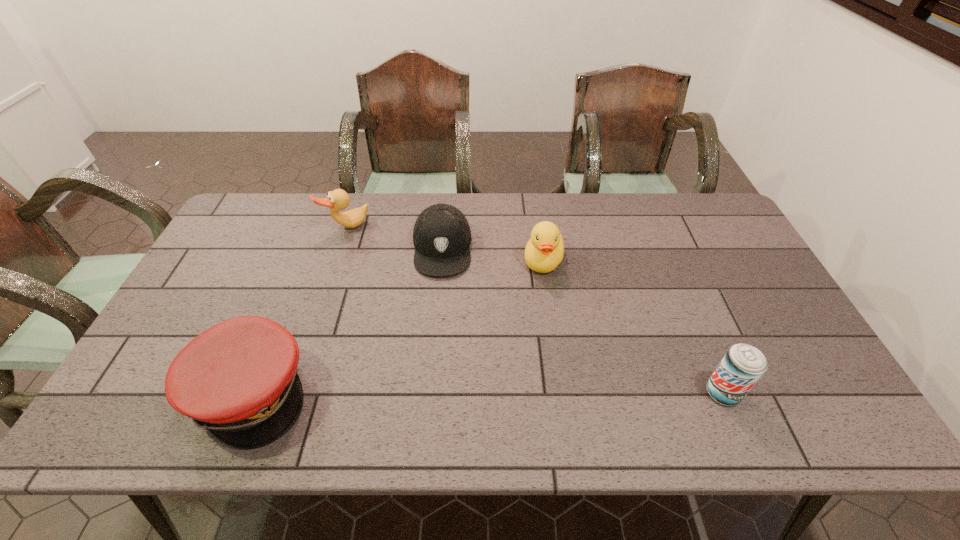
This screenshot has width=960, height=540. I want to click on blank space located 0.140m at the beak of the nearer duck, so click(x=528, y=314).

This screenshot has width=960, height=540. What are the coordinates of `free location located 0.110m at the beak of the nearer duck` in the screenshot? It's located at click(530, 306).

Find the location of `vacant region located 0.060m on the front-facing side of the third object from right to left`. vacant region located 0.060m on the front-facing side of the third object from right to left is located at coordinates pos(439,295).

You are a GUI agent. You are given a task and a screenshot of the screen. Output one action in this format:
    pyautogui.click(x=<x>, y=<y>)
    Task: Click on the vacant space located on the front-facing side of the third object from right to left
    
    Given the screenshot: What is the action you would take?
    click(439, 306)

Identify the location of vacant space positioned on the front-facing side of the third object from right to left. (439, 308).

In order to click on vacant space located on the beak of the left duck in this screenshot , I will do `click(386, 289)`.

Where is `free space located 0.280m on the beak of the left duck`? free space located 0.280m on the beak of the left duck is located at coordinates (387, 292).

Image resolution: width=960 pixels, height=540 pixels. Identify the location of vacant space located 0.310m on the beak of the left duck. (391, 299).

Find the location of `cap that is at the far edge`. cap that is at the far edge is located at coordinates (441, 236).

This screenshot has height=540, width=960. Find the location of `duck that is at the far edge`. duck that is at the far edge is located at coordinates (337, 200).